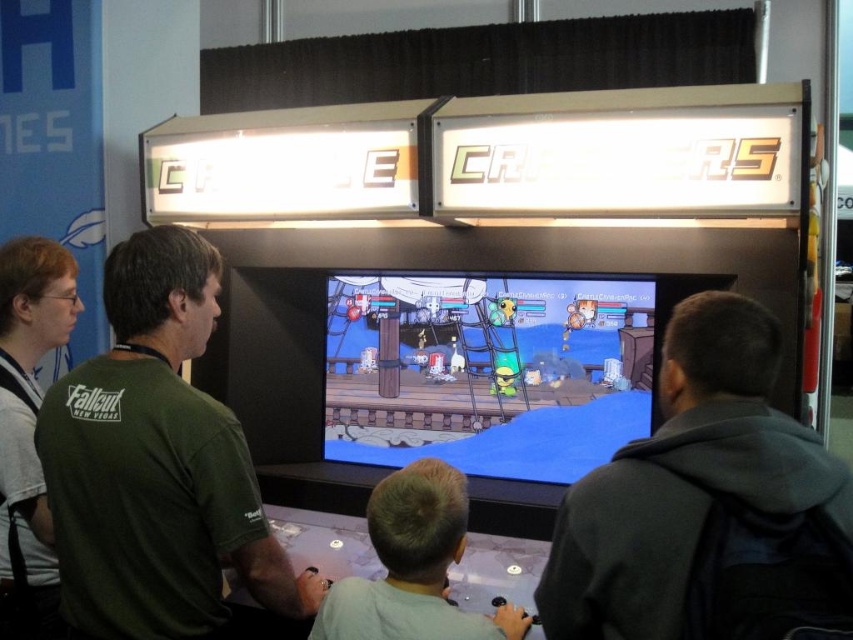
Can you confirm if dark gray hoodie at right is positioned to the left of green matte shirt at left?

Incorrect, dark gray hoodie at right is not on the left side of green matte shirt at left.

Between point (717, 392) and point (200, 442), which one is positioned behind?

Positioned behind is point (200, 442).

Find the location of `dark gray hoodie at right`. dark gray hoodie at right is located at coordinates (706, 506).

Between green matte shirt at left and light brown hair at center, which one is positioned higher?

green matte shirt at left

Who is positioned more to the right, green matte shirt at left or light brown hair at center?

From the viewer's perspective, light brown hair at center appears more on the right side.

The width and height of the screenshot is (853, 640). What do you see at coordinates (155, 464) in the screenshot? I see `green matte shirt at left` at bounding box center [155, 464].

Image resolution: width=853 pixels, height=640 pixels. In order to click on green matte shirt at left in this screenshot , I will do `click(155, 464)`.

Between point (674, 564) and point (364, 621), which one is positioned in front?

Point (674, 564) is in front.

Does dark gray hoodie at right have a smaller size compared to light brown hair at center?

Actually, dark gray hoodie at right might be larger than light brown hair at center.

Between point (759, 429) and point (456, 509), which one is positioned behind?

Point (456, 509)

At what (x,y) coordinates should I click in order to perform the action: click on dark gray hoodie at right. Please return your answer as a coordinate pair (x, y). Looking at the image, I should click on (706, 506).